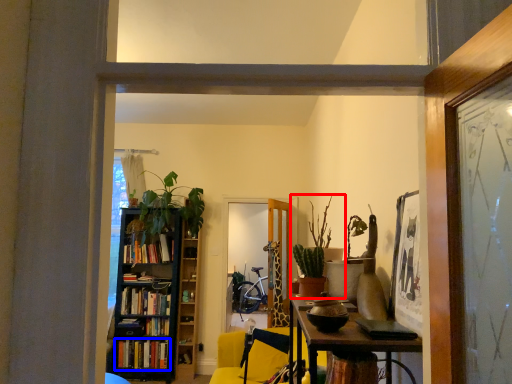
Question: Which object appears closest to the camera in this image, houseplant (highlighted by a red box) or book (highlighted by a blue box)?

Choices:
 (A) houseplant
 (B) book

Answer: (A)